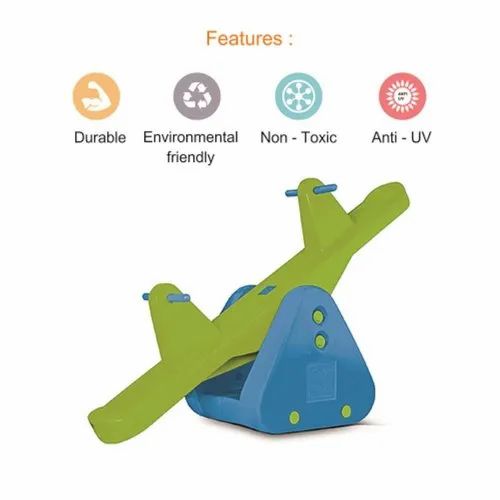
I want to click on seat, so click(117, 408), click(387, 192).